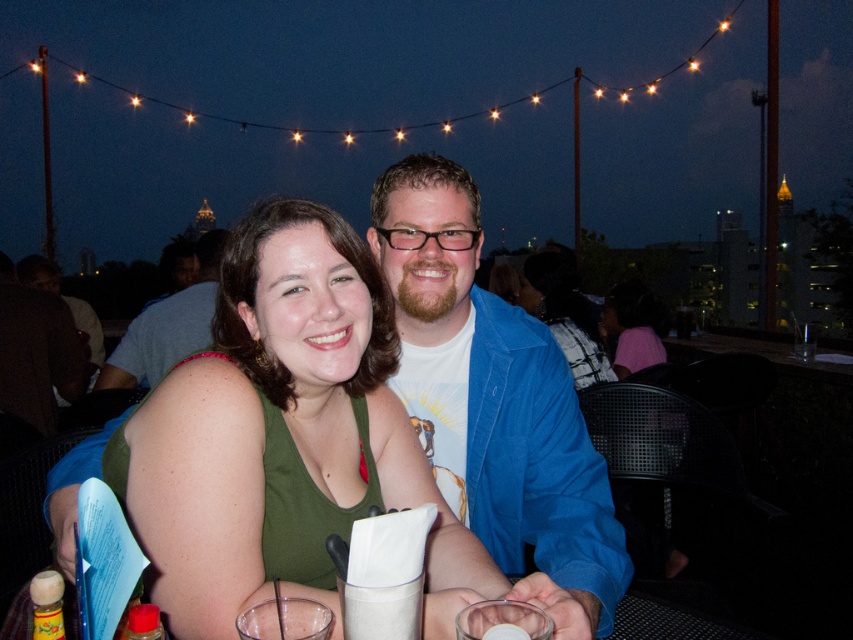
Does green fabric tank top at center have a lesser width compared to blue denim jacket at upper center?

Yes.

Who is higher up, green fabric tank top at center or blue denim jacket at upper center?

blue denim jacket at upper center is above.

Does point (247, 419) lie behind point (107, 360)?

No, (247, 419) is in front of (107, 360).

Identify the location of green fabric tank top at center. (280, 433).

Which is in front, point (566, 625) or point (265, 632)?

Point (265, 632) is in front.

Which of these two, blue cotton shirt at center or clear glass at lower center, stands taller?

blue cotton shirt at center is taller.

Does point (577, 522) come in front of point (326, 614)?

No, (577, 522) is behind (326, 614).

The image size is (853, 640). Identify the location of blue cotton shirt at center. (494, 403).

Can you confirm if green fabric tank top at center is positioned to the right of clear glass at lower center?

In fact, green fabric tank top at center is to the left of clear glass at lower center.

From the picture: Does green fabric tank top at center have a larger size compared to clear glass at lower center?

Yes.

The image size is (853, 640). I want to click on green fabric tank top at center, so click(x=280, y=433).